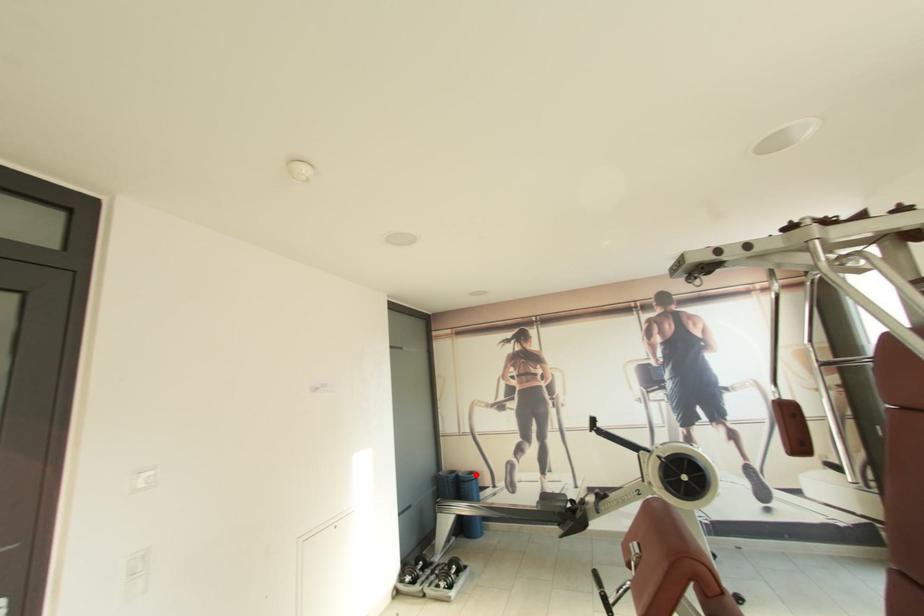
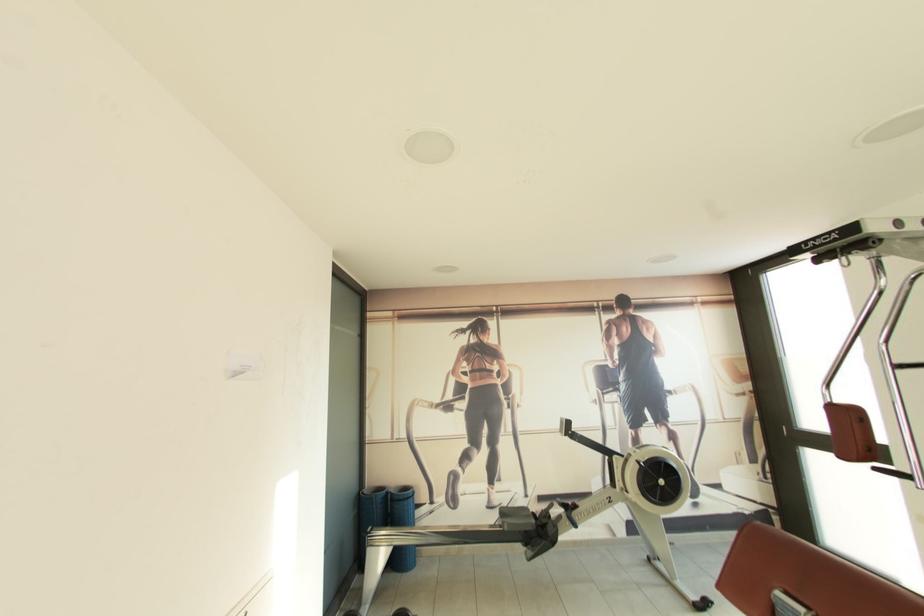
Question: I am providing you with two images of the same scene from different viewpoints. Image1 has a red point marked. In image2, the corresponding 3D location appears at what relative position? Reply with the corresponding letter.

Choices:
 (A) Closer
 (B) Farther

Answer: (A)